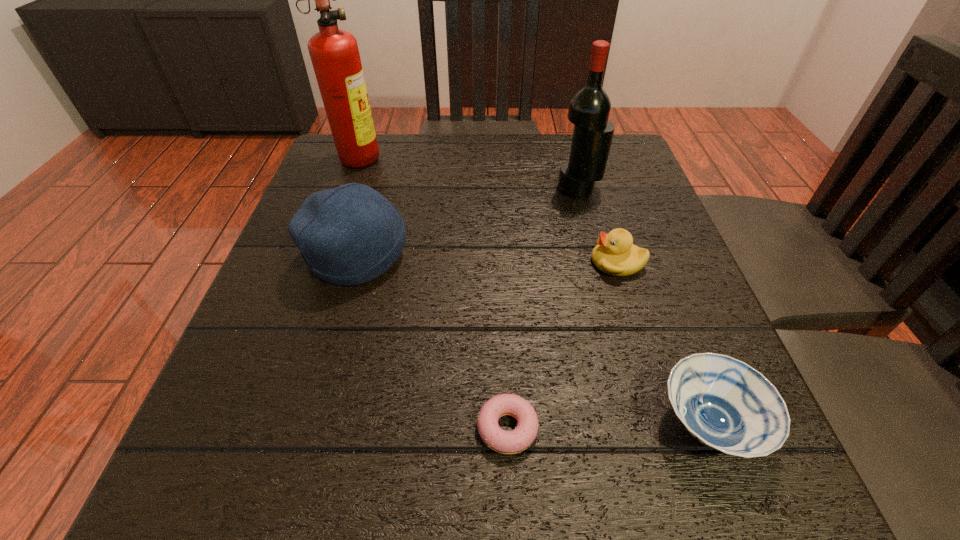
The height and width of the screenshot is (540, 960). I want to click on blank region between the second farthest object and the soup bowl, so 644,306.

At what (x,y) coordinates should I click in order to perform the action: click on free space between the duckling and the third tallest object. Please return your answer as a coordinate pair (x, y). Image resolution: width=960 pixels, height=540 pixels. Looking at the image, I should click on (488, 259).

Locate an element on the screen. The height and width of the screenshot is (540, 960). vacant area that lies between the tallest object and the fifth shortest object is located at coordinates (469, 172).

Where is `free space that is in between the soup bowl and the farthest object`? The image size is (960, 540). free space that is in between the soup bowl and the farthest object is located at coordinates (534, 290).

At what (x,y) coordinates should I click in order to perform the action: click on free spot between the soup bowl and the shortest object. Please return your answer as a coordinate pair (x, y). This screenshot has height=540, width=960. Looking at the image, I should click on point(608,426).

Find the location of `empty space that is in between the duckling and the soup bowl`. empty space that is in between the duckling and the soup bowl is located at coordinates (663, 343).

Where is `vacant area between the farthest object and the soup bowl`? vacant area between the farthest object and the soup bowl is located at coordinates (534, 290).

Where is `object that is the second closest one to the second tallest object`? The image size is (960, 540). object that is the second closest one to the second tallest object is located at coordinates (349, 235).

You are a GUI agent. You are given a task and a screenshot of the screen. Output one action in this format:
    pyautogui.click(x=<x>, y=<y>)
    Task: Click on the object that is the fifth closest to the farthest object
    This screenshot has height=540, width=960.
    Given the screenshot: What is the action you would take?
    pyautogui.click(x=724, y=403)

Locate an element on the screen. free point that satisfies the following two spatial constraints: 1. on the front-facing side of the farthest object; 2. on the left side of the third object from left to right is located at coordinates (262, 428).